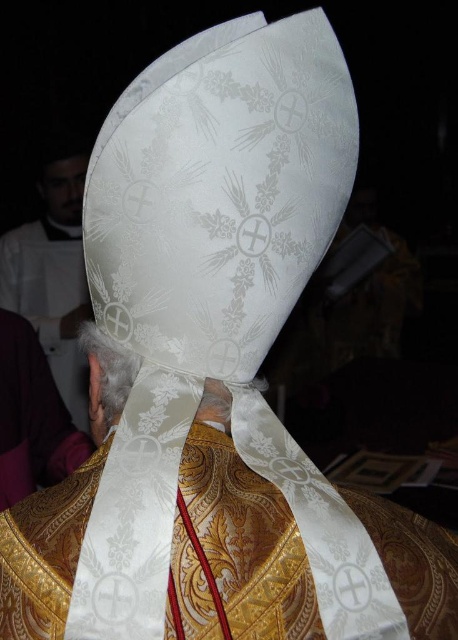
From the picture: You are an art conservator examining the mitre in the image. You notice two points marked on the mitre. The first point is at coordinates point (67, 202) and the second is at point (109, 392). Which of these points is closer to you?

Point (67, 202) is closer to you because it is further to the viewer than point (109, 392).

You are a photographer adjusting your camera settings to capture the intricate details of the white silk vestment at upper left and the matte black head at upper left. The camera has a depth of field that can focus on objects within a 5 inch range. Will both objects be in focus at the same time?

The white silk vestment at upper left is 5.36 inches from matte black head at upper left. Since the distance between them exceeds the camera lens depth of field range of 5 inches, they cannot both be in focus simultaneously.

You are an art student analyzing a religious portrait. You notice the white satin headband at center and the matte black head at upper left. Based on their positions, which object is closer to the right edge of the image?

The white satin headband at center is closer to the right edge of the image because it is positioned to the right of the matte black head at upper left.